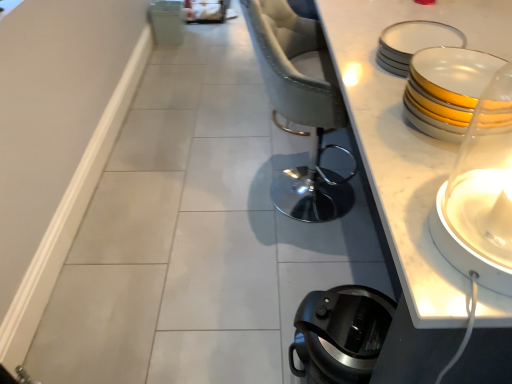
The image size is (512, 384). I want to click on free space above black plastic coffee pot at lower right (from a real-world perspective), so click(x=353, y=321).